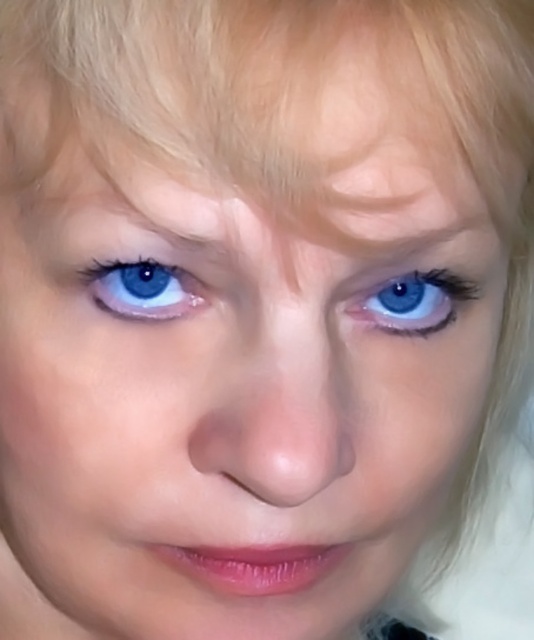
You are a photographer adjusting your camera settings to capture the best detail of the blue glossy eye at center and the blue glossy eye at upper left. Which eye should you focus on to ensure it appears larger in the final photo?

The blue glossy eye at center is larger in size than the blue glossy eye at upper left, so focusing on the blue glossy eye at center will ensure it appears larger in the final photo.

You are a photographer adjusting the focus on a camera. You need to ensure that the blue glossy eye at center is in sharp focus. Given that the camera can only focus on a single point, would the point at coordinates point (412,301) be the correct point to select for focusing?

Yes, the point (412,301) marks the blue glossy eye at center, so selecting this point would ensure the eye is in sharp focus.